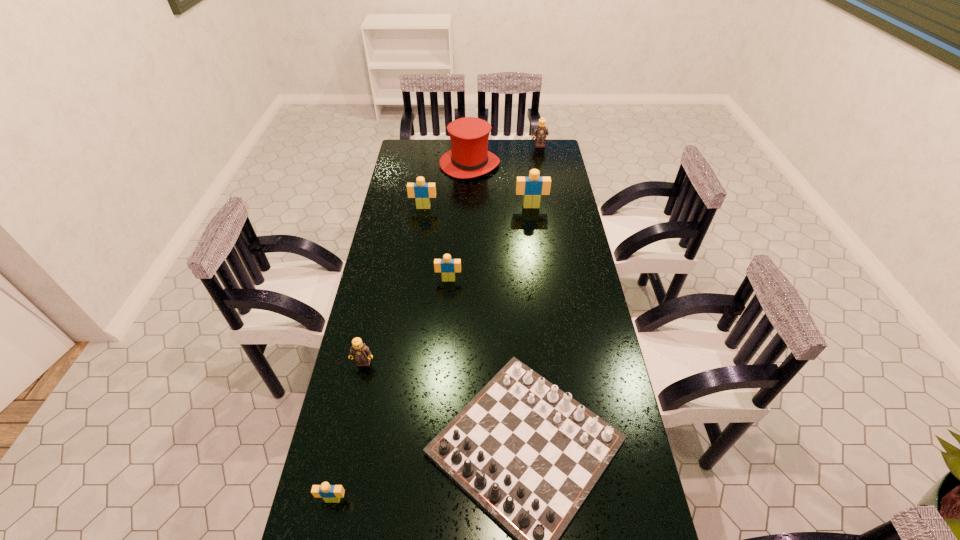
The image size is (960, 540). I want to click on unoccupied position between the leftmost beige Lego and the tallest Lego, so click(432, 353).

This screenshot has width=960, height=540. What are the coordinates of `free space between the seventh nearest object and the leftmost beige Lego` in the screenshot? It's located at (401, 332).

The width and height of the screenshot is (960, 540). Identify the location of empty location between the biggest beige Lego and the smaller tan Lego. (447, 285).

Where is `the fifth closest object relative to the third Lego from right to left`? the fifth closest object relative to the third Lego from right to left is located at coordinates (469, 157).

The height and width of the screenshot is (540, 960). Find the location of `object that ranks as the sixth closest to the seventh nearest object`. object that ranks as the sixth closest to the seventh nearest object is located at coordinates (359, 351).

The height and width of the screenshot is (540, 960). Find the location of `Lego that stands as the sixth closest to the chessboard`. Lego that stands as the sixth closest to the chessboard is located at coordinates 540,131.

Identify the location of Lego that stands as the closest to the red hat. The width and height of the screenshot is (960, 540). (540, 131).

Point out which beige Lego is positioned as the nearest to the white chessboard. Please provide its 2D coordinates. Your answer should be formatted as a tuple, i.e. [(x, y)], where the tuple contains the x and y coordinates of a point satisfying the conditions above.

[(330, 493)]

Choose which beige Lego is the third nearest neighbor to the third Lego from left to right. Please provide its 2D coordinates. Your answer should be formatted as a tuple, i.e. [(x, y)], where the tuple contains the x and y coordinates of a point satisfying the conditions above.

[(330, 493)]

Find the location of a particular element. The image size is (960, 540). the closest tan Lego to the shortest Lego is located at coordinates (359, 351).